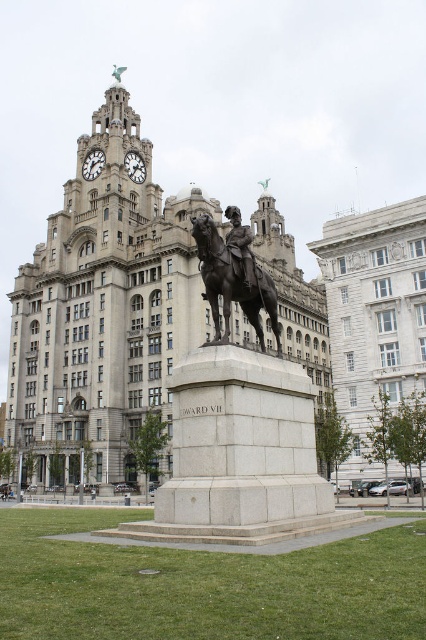
You are standing at the point marked by the coordinates point (281, 352). You want to take a photo of the statue of King Edward VII. Is the statue visible from your current position?

The statue of King Edward VII is visible from the point (281, 352) because there are no obstructions mentioned in the scene description between the statue and the point. The building in the background is grand but its position relative to the point isn not specified to block the view.

You are standing at the point marked as point [233,276] in the image. What object is directly in front of you?

The polished bronze horse at center is directly in front of you at point [233,276].

You are a tourist in the park and want to take a photo of the polished bronze statue at center with the gray stone tower at center in the background. Based on their positions, can you position yourself so that both are fully visible in your camera frame?

The gray stone tower at center is to the left of the polished bronze statue at center, so positioning yourself to the right side of the statue will allow both the statue and the tower to be captured in the frame.